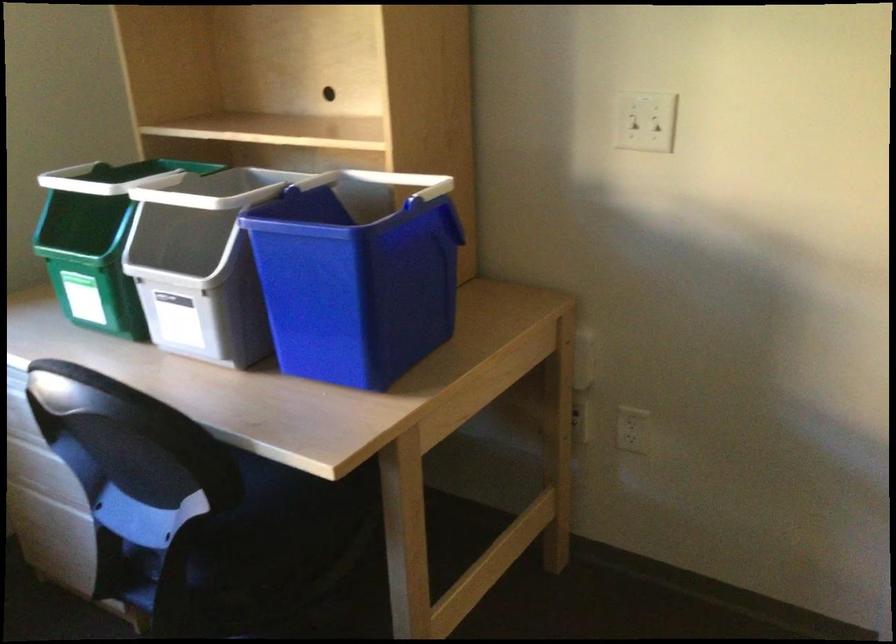
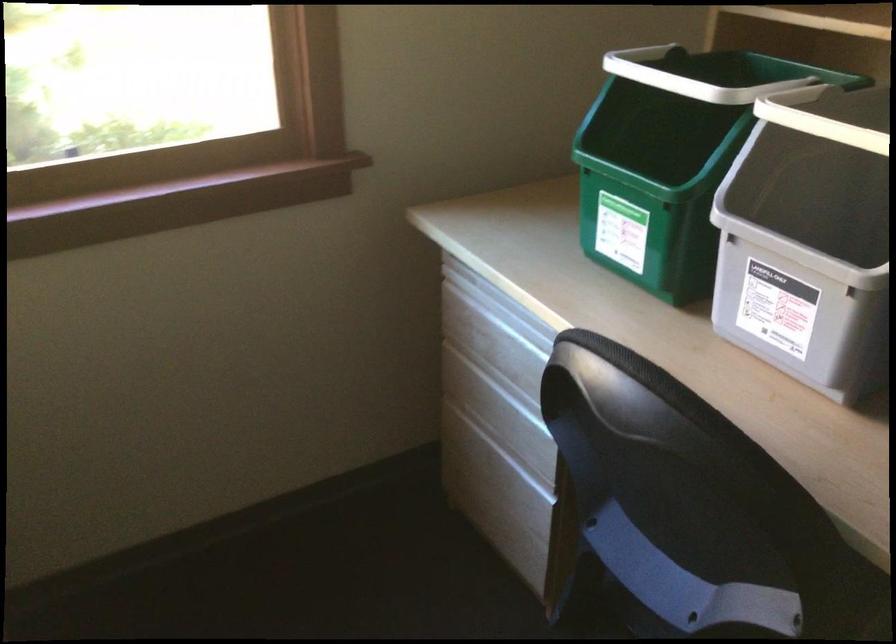
Find the pixel in the second image that matches point 92,269 in the first image.

(652, 194)